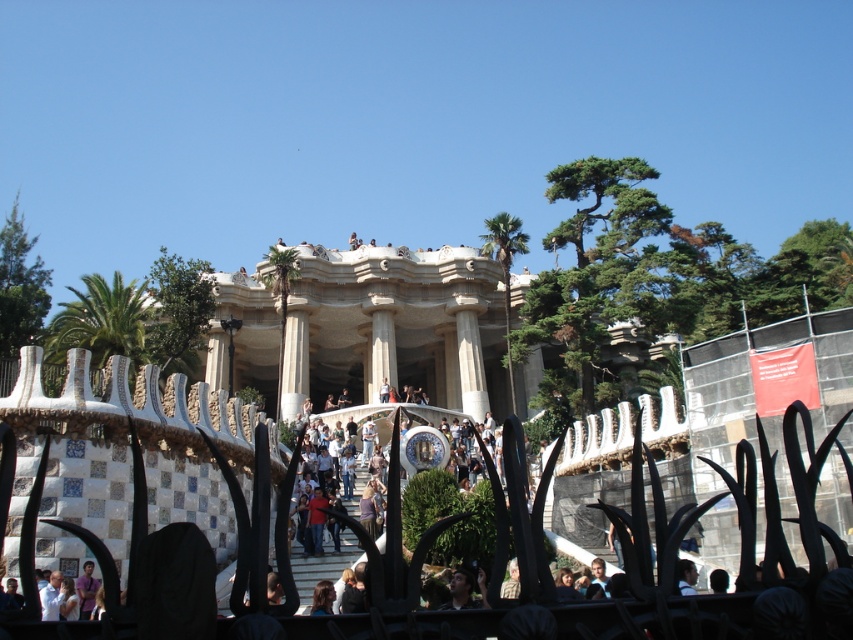
You are standing at the entrance of the Park and want to take a photo of the white stone palace at center. Based on its coordinates, where should you position yourself to capture it in the frame?

The white stone palace at center is located at point [373,330], so you should position yourself directly in front of it to ensure it is centered in your photo.

You are a tour guide standing at the bottom of the staircase in front of the Gaudian structure. You notice a tourist with dark brown hair at center. Can you estimate the coordinates of their position relative to the scene?

The dark brown hair at center is located at coordinates point (465, 589).

You are a photographer standing at the bottom of the staircase in front of the Gaudian structure. You want to take a photo of the dark brown hair at center and the dark brown leather jacket at lower center so that both are fully visible in the frame. Which object should you focus on first to ensure both are in focus?

You should focus on the dark brown leather jacket at lower center first because it is taller than the dark brown hair at center, ensuring both will be in focus when focusing on the closer or taller object.